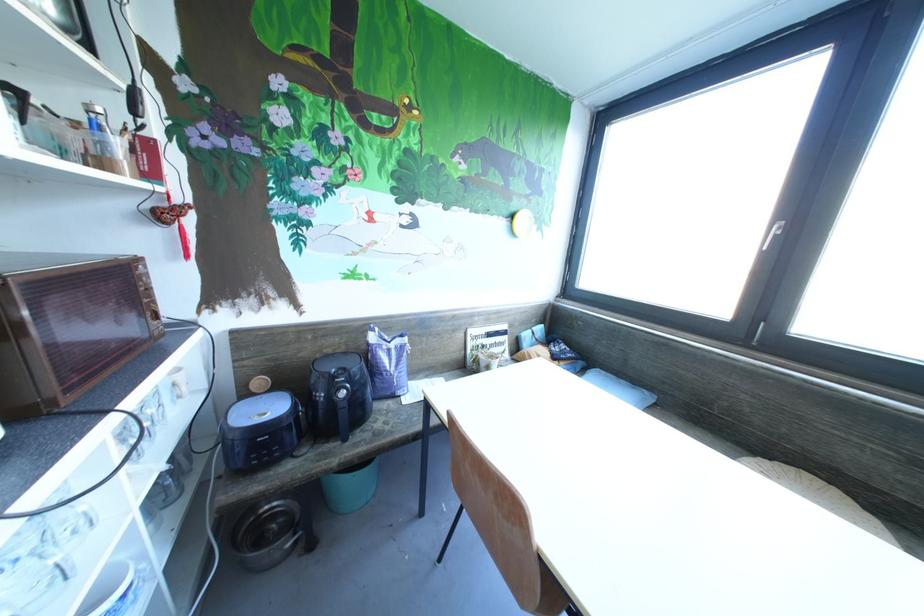
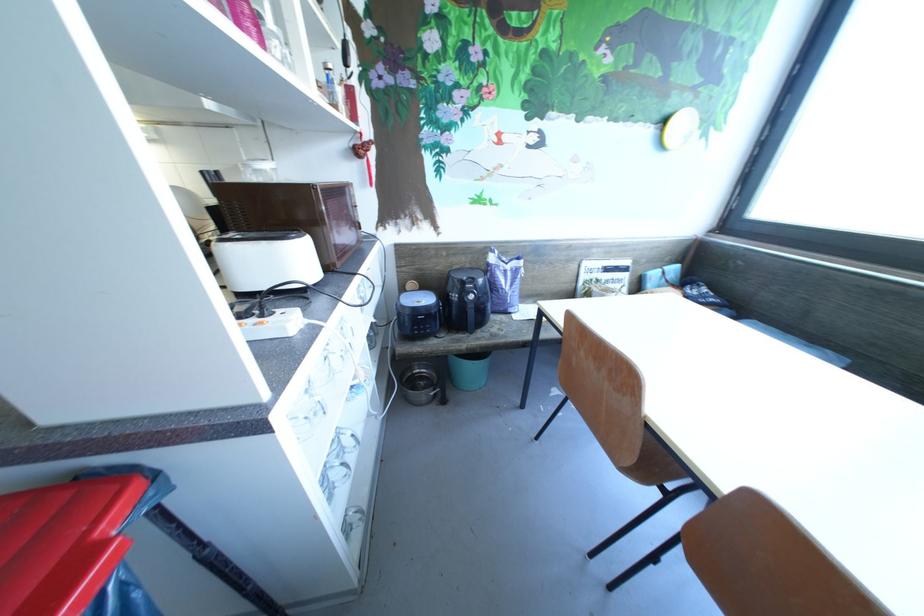
The point at (280, 521) is marked in the first image. Where is the corresponding point in the second image?

(427, 379)